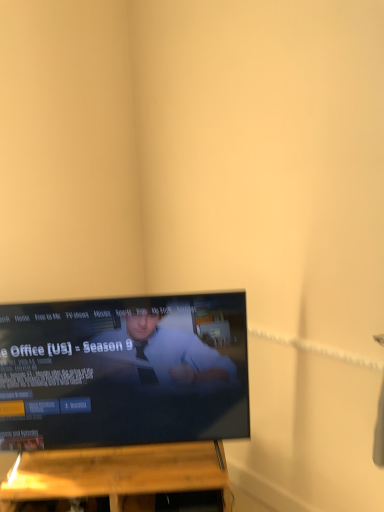
Locate an element on the screen. The width and height of the screenshot is (384, 512). black glossy tv at center is located at coordinates (124, 371).

Image resolution: width=384 pixels, height=512 pixels. Describe the element at coordinates (124, 371) in the screenshot. I see `black glossy tv at center` at that location.

The width and height of the screenshot is (384, 512). What do you see at coordinates (120, 479) in the screenshot? I see `wooden shelf at lower center` at bounding box center [120, 479].

In order to face wooden shelf at lower center, should I rotate leftwards or rightwards?

It's best to rotate left around 9.397 degrees.

Locate an element on the screen. wooden shelf at lower center is located at coordinates (120, 479).

Find the location of `black glossy tv at center`. black glossy tv at center is located at coordinates (124, 371).

Considering the relative positions of wooden shelf at lower center and black glossy tv at center in the image provided, is wooden shelf at lower center to the right of black glossy tv at center from the viewer's perspective?

Yes, wooden shelf at lower center is to the right of black glossy tv at center.

Is the position of wooden shelf at lower center less distant than that of black glossy tv at center?

No, wooden shelf at lower center is further to the viewer.

Considering the positions of point (173, 471) and point (9, 337), is point (173, 471) closer or farther from the camera than point (9, 337)?

Point (173, 471) is positioned farther from the camera compared to point (9, 337).

From the image's perspective, is wooden shelf at lower center under black glossy tv at center?

Yes, from the image's perspective, wooden shelf at lower center is beneath black glossy tv at center.

From a real-world perspective, who is located higher, wooden shelf at lower center or black glossy tv at center?

From a 3D spatial view, black glossy tv at center is above.

Between wooden shelf at lower center and black glossy tv at center, which one has larger width?

Wider between the two is wooden shelf at lower center.

Which of these two, wooden shelf at lower center or black glossy tv at center, stands taller?

With more height is black glossy tv at center.

Between wooden shelf at lower center and black glossy tv at center, which one has smaller size?

wooden shelf at lower center is smaller.

Is wooden shelf at lower center not within black glossy tv at center?

Yes, wooden shelf at lower center is outside of black glossy tv at center.

Is there a large distance between wooden shelf at lower center and black glossy tv at center?

No, wooden shelf at lower center is in close proximity to black glossy tv at center.

Is wooden shelf at lower center oriented away from black glossy tv at center?

No, wooden shelf at lower center's orientation is not away from black glossy tv at center.

Measure the distance from wooden shelf at lower center to black glossy tv at center.

11.56 inches.

You are a GUI agent. You are given a task and a screenshot of the screen. Output one action in this format:
    pyautogui.click(x=<x>, y=<y>)
    Task: Click on the television lying on the left of wooden shelf at lower center
    
    Given the screenshot: What is the action you would take?
    pyautogui.click(x=124, y=371)

Which is more to the left, black glossy tv at center or wooden shelf at lower center?

From the viewer's perspective, black glossy tv at center appears more on the left side.

Which object is further away from the camera taking this photo, black glossy tv at center or wooden shelf at lower center?

wooden shelf at lower center is more distant.

Is point (198, 436) closer to viewer compared to point (152, 470)?

No, it is not.

From the image's perspective, which one is positioned lower, black glossy tv at center or wooden shelf at lower center?

wooden shelf at lower center is shown below in the image.

From a real-world perspective, who is located lower, black glossy tv at center or wooden shelf at lower center?

From a 3D spatial view, wooden shelf at lower center is below.

In the scene shown: Which object is thinner, black glossy tv at center or wooden shelf at lower center?

black glossy tv at center.

Is black glossy tv at center taller than wooden shelf at lower center?

Indeed, black glossy tv at center has a greater height compared to wooden shelf at lower center.

Which of these two, black glossy tv at center or wooden shelf at lower center, is bigger?

With larger size is black glossy tv at center.

Does black glossy tv at center contain wooden shelf at lower center?

No, wooden shelf at lower center is not inside black glossy tv at center.

Is black glossy tv at center with wooden shelf at lower center?

No, black glossy tv at center is not making contact with wooden shelf at lower center.

Is black glossy tv at center facing towards wooden shelf at lower center?

No, black glossy tv at center is not turned towards wooden shelf at lower center.

Can you tell me how much black glossy tv at center and wooden shelf at lower center differ in facing direction?

There is a 4.04e-05-degree angle between the facing directions of black glossy tv at center and wooden shelf at lower center.

Measure the distance between black glossy tv at center and wooden shelf at lower center.

29.37 centimeters.

In the image, there is a wooden shelf at lower center. Where is `television above it (from the image's perspective)`? The image size is (384, 512). television above it (from the image's perspective) is located at coordinates (124, 371).

You are a GUI agent. You are given a task and a screenshot of the screen. Output one action in this format:
    pyautogui.click(x=<x>, y=<y>)
    Task: Click on the television in front of the wooden shelf at lower center
    
    Given the screenshot: What is the action you would take?
    click(x=124, y=371)

The width and height of the screenshot is (384, 512). Identify the location of television above the wooden shelf at lower center (from a real-world perspective). (124, 371).